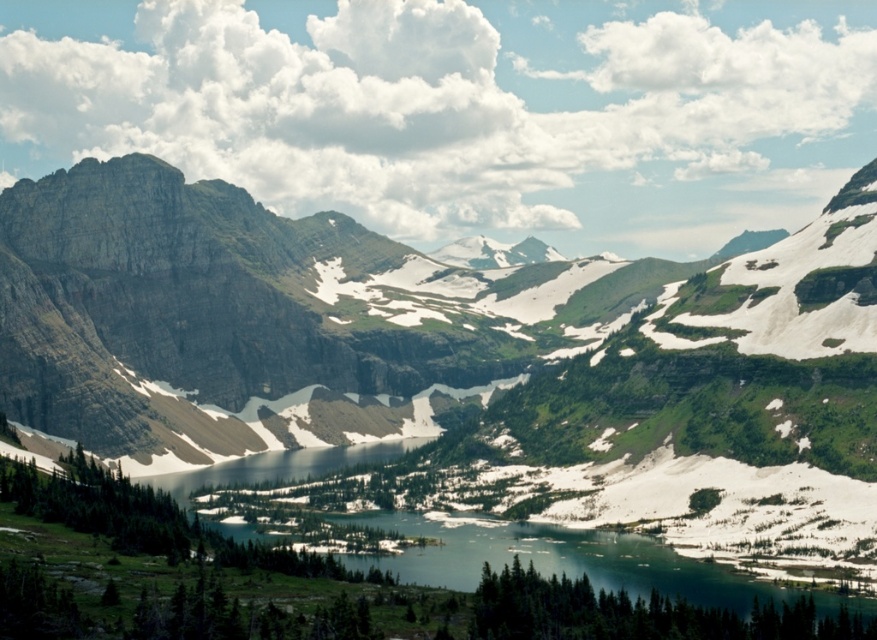
Question: Considering the relative positions of rocky mountain range at left and clear blue water at center in the image provided, where is rocky mountain range at left located with respect to clear blue water at center?

Choices:
 (A) above
 (B) below

Answer: (A)

Question: Which of the following is the closest to the observer?

Choices:
 (A) (232, 422)
 (B) (443, 525)

Answer: (B)

Question: Does rocky mountain range at left have a greater width compared to clear blue water at center?

Choices:
 (A) no
 (B) yes

Answer: (B)

Question: Is rocky mountain range at left below clear blue water at center?

Choices:
 (A) yes
 (B) no

Answer: (B)

Question: Which point is farther to the camera?

Choices:
 (A) (68, 413)
 (B) (704, 588)

Answer: (A)